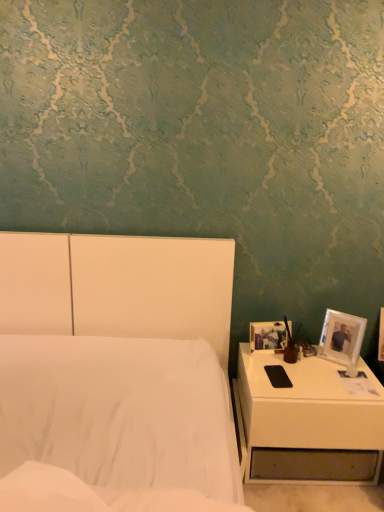
Question: From the image's perspective, is white matte bed at center over matte brown vase at right?

Choices:
 (A) no
 (B) yes

Answer: (A)

Question: Is matte brown vase at right located within white matte bed at center?

Choices:
 (A) yes
 (B) no

Answer: (B)

Question: Is white matte bed at center thinner than matte brown vase at right?

Choices:
 (A) no
 (B) yes

Answer: (A)

Question: Does white matte bed at center have a larger size compared to matte brown vase at right?

Choices:
 (A) yes
 (B) no

Answer: (A)

Question: Does white matte bed at center have a greater height compared to matte brown vase at right?

Choices:
 (A) yes
 (B) no

Answer: (A)

Question: Considering the relative sizes of white matte bed at center and matte brown vase at right in the image provided, is white matte bed at center smaller than matte brown vase at right?

Choices:
 (A) yes
 (B) no

Answer: (B)

Question: From a real-world perspective, does white glossy nightstand at lower right sit lower than matte plastic picture frame at right, the 1th picture frame from the left?

Choices:
 (A) no
 (B) yes

Answer: (B)

Question: Is white glossy nightstand at lower right not close to matte plastic picture frame at right, the 1th picture frame from the left?

Choices:
 (A) yes
 (B) no

Answer: (B)

Question: Would you say white glossy nightstand at lower right contains matte plastic picture frame at right, the 1th picture frame from the left?

Choices:
 (A) yes
 (B) no

Answer: (B)

Question: Considering the relative sizes of white glossy nightstand at lower right and matte plastic picture frame at right, the 1th picture frame from the left, in the image provided, is white glossy nightstand at lower right bigger than matte plastic picture frame at right, the 1th picture frame from the left,?

Choices:
 (A) no
 (B) yes

Answer: (B)

Question: Considering the relative sizes of white glossy nightstand at lower right and matte plastic picture frame at right, which is the 2th picture frame from right to left, in the image provided, is white glossy nightstand at lower right thinner than matte plastic picture frame at right, which is the 2th picture frame from right to left,?

Choices:
 (A) no
 (B) yes

Answer: (A)

Question: From the image's perspective, is white glossy nightstand at lower right beneath matte plastic picture frame at right, the 1th picture frame from the left?

Choices:
 (A) no
 (B) yes

Answer: (B)

Question: Can you confirm if white glossy nightstand at lower right is positioned to the left of matte brown vase at right?

Choices:
 (A) yes
 (B) no

Answer: (B)